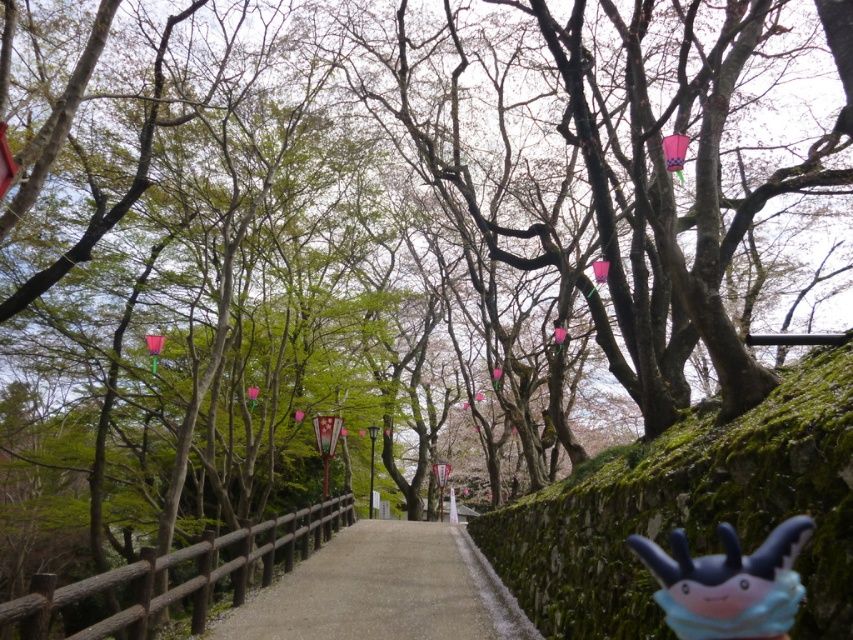
Is brown wooden fence at center bigger than blue plush toy at lower right?

Yes, brown wooden fence at center is bigger than blue plush toy at lower right.

In the scene shown: Does brown wooden fence at center have a lesser width compared to blue plush toy at lower right?

No, brown wooden fence at center is not thinner than blue plush toy at lower right.

At what (x,y) coordinates should I click in order to perform the action: click on brown wooden fence at center. Please return your answer as a coordinate pair (x, y). The image size is (853, 640). Looking at the image, I should click on tap(183, 573).

Is smooth concrete path at center thinner than brown wooden fence at center?

Yes.

Between smooth concrete path at center and brown wooden fence at center, which one appears on the right side from the viewer's perspective?

smooth concrete path at center is more to the right.

Is point (399, 554) closer to viewer compared to point (276, 548)?

No, it is behind (276, 548).

Image resolution: width=853 pixels, height=640 pixels. I want to click on smooth concrete path at center, so click(x=383, y=589).

Between smooth concrete path at center and blue plush toy at lower right, which one has more height?

Standing taller between the two is smooth concrete path at center.

Can you confirm if smooth concrete path at center is thinner than blue plush toy at lower right?

No.

Is point (454, 528) positioned before point (714, 577)?

No, it is behind (714, 577).

This screenshot has width=853, height=640. Find the location of `smooth concrete path at center`. smooth concrete path at center is located at coordinates (383, 589).